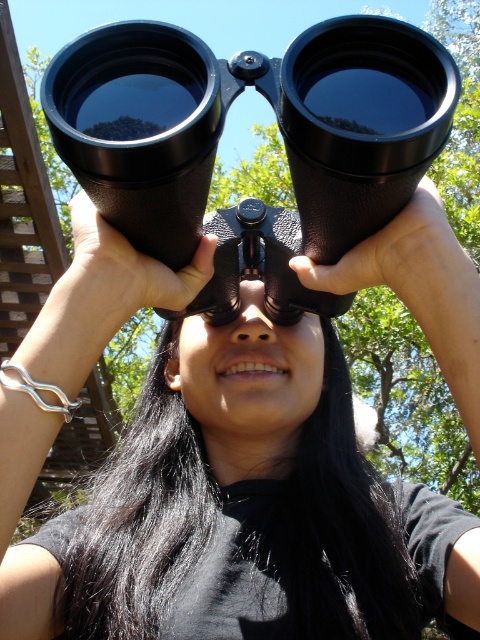
Measure the distance from black matte binoculars at center to black rubber binoculars at center.

black matte binoculars at center is 6.14 inches away from black rubber binoculars at center.

Is black matte binoculars at center thinner than black rubber binoculars at center?

No, black matte binoculars at center is not thinner than black rubber binoculars at center.

Which is behind, point (307, 618) or point (358, 58)?

The point (307, 618) is more distant.

You are a GUI agent. You are given a task and a screenshot of the screen. Output one action in this format:
    pyautogui.click(x=<x>, y=<y>)
    Task: Click on the black matte binoculars at center
    Image resolution: width=480 pixels, height=640 pixels.
    Given the screenshot: What is the action you would take?
    pyautogui.click(x=213, y=477)